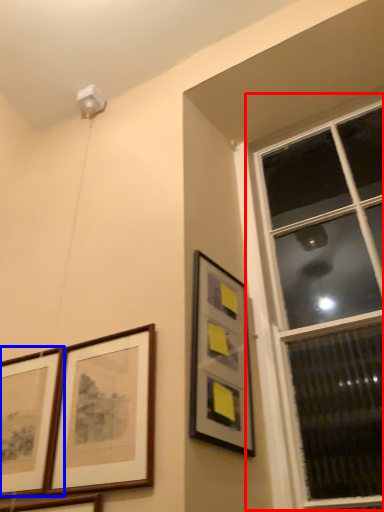
Question: Which object is further to the camera taking this photo, window (highlighted by a red box) or picture frame (highlighted by a blue box)?

Choices:
 (A) window
 (B) picture frame

Answer: (B)